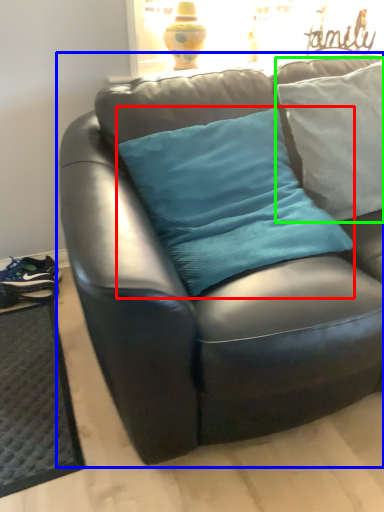
Question: Based on their relative distances, which object is farther from pillow (highlighted by a red box)? Choose from studio couch (highlighted by a blue box) and pillow (highlighted by a green box).

Choices:
 (A) studio couch
 (B) pillow

Answer: (B)